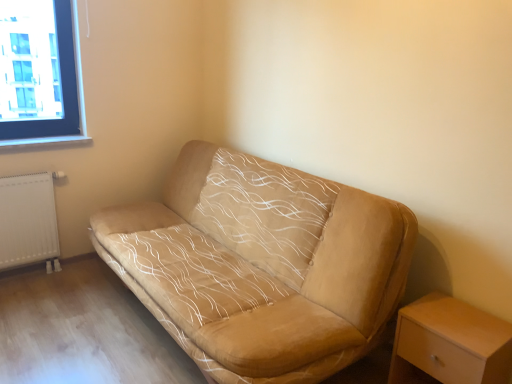
You are a GUI agent. You are given a task and a screenshot of the screen. Output one action in this format:
    pyautogui.click(x=<x>, y=<y>)
    Task: Click on the vacant space to the right of white matte radiator at lower left
    
    Given the screenshot: What is the action you would take?
    pyautogui.click(x=76, y=279)